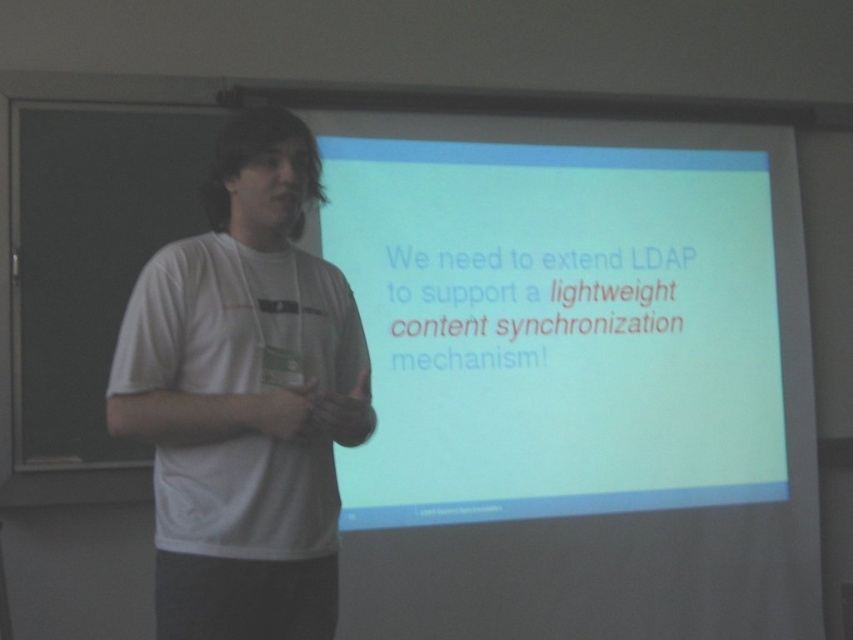
Can you confirm if white matte projection screen at center is smaller than white cotton shirt at center?

No, white matte projection screen at center is not smaller than white cotton shirt at center.

Is white matte projection screen at center to the left of white cotton shirt at center from the viewer's perspective?

Incorrect, white matte projection screen at center is not on the left side of white cotton shirt at center.

At what (x,y) coordinates should I click in order to perform the action: click on white matte projection screen at center. Please return your answer as a coordinate pair (x, y). The image size is (853, 640). Looking at the image, I should click on (556, 326).